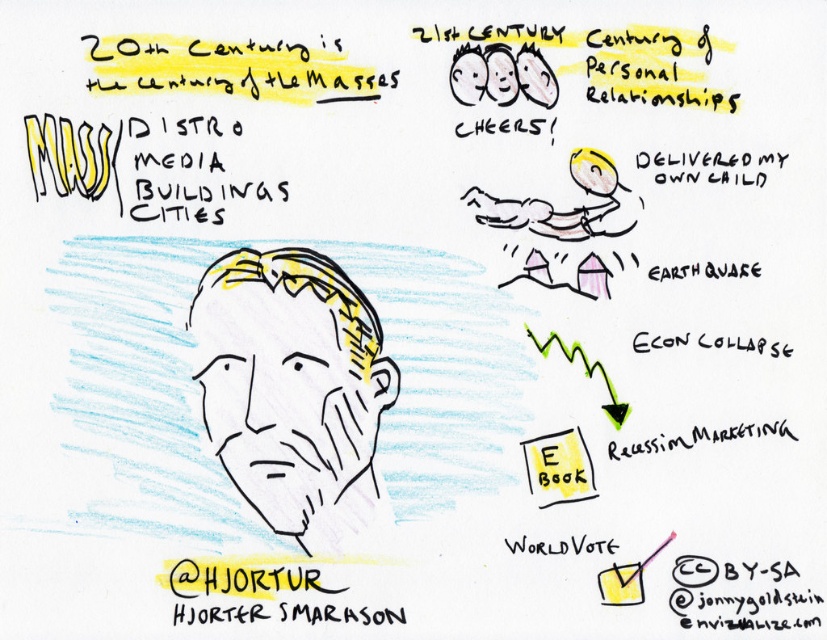
Describe the element at coordinates (729, 600) in the screenshot. The height and width of the screenshot is (640, 827). I see `blacktextured papercc by-sa logo at lower right` at that location.

In the scene shown: Is blacktextured papercc by-sa logo at lower right bigger than yellow paper e-book at center?

Correct, blacktextured papercc by-sa logo at lower right is larger in size than yellow paper e-book at center.

Which is behind, point (705, 570) or point (531, 440)?

The point (531, 440) is behind.

In order to click on blacktextured papercc by-sa logo at lower right in this screenshot , I will do `click(729, 600)`.

Is black line drawing of a man at center to the left of black handwritten text at lower center from the viewer's perspective?

Yes, black line drawing of a man at center is to the left of black handwritten text at lower center.

Between black line drawing of a man at center and black handwritten text at lower center, which one has more height?

With more height is black line drawing of a man at center.

Describe the element at coordinates (292, 388) in the screenshot. This screenshot has height=640, width=827. I see `black line drawing of a man at center` at that location.

The width and height of the screenshot is (827, 640). What are the coordinates of `black line drawing of a man at center` in the screenshot? It's located at (292, 388).

Is black line drawing of a man at center wider than yellow paper e-book at center?

Yes.

Based on the photo, is black line drawing of a man at center further to camera compared to yellow paper e-book at center?

Yes.

The image size is (827, 640). What are the coordinates of `black line drawing of a man at center` in the screenshot? It's located at pyautogui.click(x=292, y=388).

At what (x,y) coordinates should I click in order to perform the action: click on black line drawing of a man at center. Please return your answer as a coordinate pair (x, y). Image resolution: width=827 pixels, height=640 pixels. Looking at the image, I should click on (292, 388).